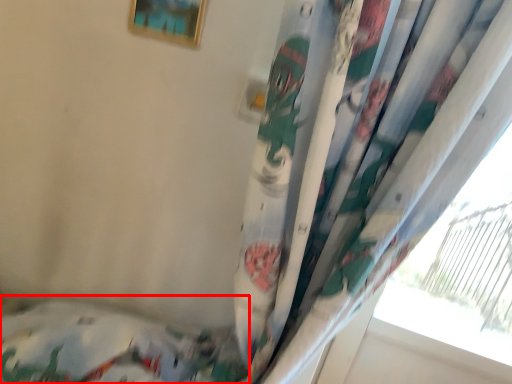
Question: Considering the relative positions of bed (annotated by the red box) and picture frame in the image provided, where is bed (annotated by the red box) located with respect to the staircase?

Choices:
 (A) left
 (B) right

Answer: (A)